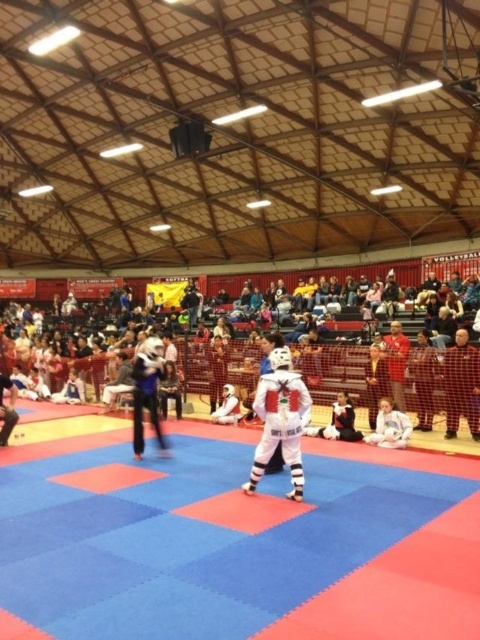
Question: Is white fabric crowd at center below white matte karate gi at center?

Choices:
 (A) no
 (B) yes

Answer: (A)

Question: Which point appears farthest from the camera in this image?

Choices:
 (A) (276, 420)
 (B) (194, 339)

Answer: (B)

Question: Which point is farther to the camera?

Choices:
 (A) white matte karate uniform at center
 (B) white matte karate gi at center

Answer: (B)

Question: Which point is farther to the camera?

Choices:
 (A) white fabric crowd at center
 (B) white matte karate uniform at center

Answer: (A)

Question: Can you confirm if white matte karate uniform at center is positioned to the left of white matte karate gi at center?

Choices:
 (A) yes
 (B) no

Answer: (A)

Question: In this image, where is white matte karate uniform at center located relative to white matte karate gi at center?

Choices:
 (A) above
 (B) below

Answer: (A)